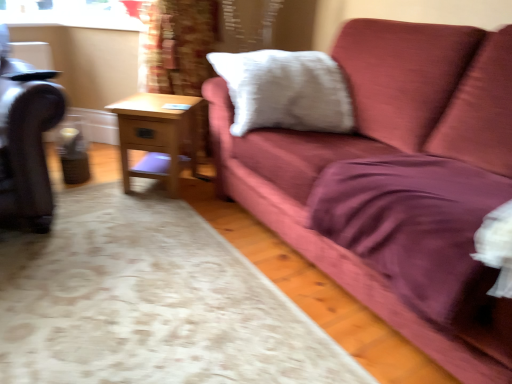
I want to click on wooden side table at center, so pos(159,135).

Describe the element at coordinates (285, 91) in the screenshot. I see `white soft pillow at upper center` at that location.

You are a GUI agent. You are given a task and a screenshot of the screen. Output one action in this format:
    pyautogui.click(x=<x>, y=<y>)
    Task: Click on the wooden side table at center
    The width and height of the screenshot is (512, 384).
    Given the screenshot: What is the action you would take?
    pyautogui.click(x=159, y=135)

Is white soft pillow at upper center wider than leather swivel chair at left?

No, white soft pillow at upper center is not wider than leather swivel chair at left.

From the image's perspective, is white soft pillow at upper center under leather swivel chair at left?

No.

Considering the relative sizes of white soft pillow at upper center and leather swivel chair at left in the image provided, is white soft pillow at upper center taller than leather swivel chair at left?

In fact, white soft pillow at upper center may be shorter than leather swivel chair at left.

Consider the image. Measure the distance from white soft pillow at upper center to leather swivel chair at left.

The distance of white soft pillow at upper center from leather swivel chair at left is 38.45 inches.

From a real-world perspective, is leather swivel chair at left physically below wooden side table at center?

No.

Considering the positions of objects leather swivel chair at left and wooden side table at center in the image provided, who is behind, leather swivel chair at left or wooden side table at center?

wooden side table at center is more distant.

Is leather swivel chair at left oriented towards wooden side table at center?

No, leather swivel chair at left is not oriented towards wooden side table at center.

Find the location of a particular element. Image resolution: width=512 pixels, height=384 pixels. swivel chair positioned vertically above the wooden side table at center (from a real-world perspective) is located at coordinates (26, 140).

Between white soft pillow at upper center and wooden side table at center, which one has less height?

wooden side table at center.

Would you say white soft pillow at upper center is to the left or to the right of wooden side table at center in the picture?

Based on their positions, white soft pillow at upper center is located to the right of wooden side table at center.

From a real-world perspective, who is located higher, white soft pillow at upper center or wooden side table at center?

white soft pillow at upper center is physically above.

Measure the distance from white soft pillow at upper center to wooden side table at center.

A distance of 50.00 centimeters exists between white soft pillow at upper center and wooden side table at center.

Is wooden side table at center facing away from leather swivel chair at left?

No.

Who is more distant, wooden side table at center or leather swivel chair at left?

wooden side table at center is more distant.

Measure the distance between wooden side table at center and leather swivel chair at left.

wooden side table at center is 54.48 centimeters away from leather swivel chair at left.

Do you think wooden side table at center is within leather swivel chair at left, or outside of it?

wooden side table at center is located beyond the bounds of leather swivel chair at left.

Between wooden side table at center and white soft pillow at upper center, which one has larger size?

Bigger between the two is white soft pillow at upper center.

Is point (183, 137) closer or farther from the camera than point (242, 57)?

Point (183, 137) is positioned farther from the camera compared to point (242, 57).

Is wooden side table at center in front of or behind white soft pillow at upper center in the image?

Visually, wooden side table at center is located behind white soft pillow at upper center.

Locate an element on the screen. The height and width of the screenshot is (384, 512). table to the left of white soft pillow at upper center is located at coordinates (159, 135).

Considering the positions of point (34, 219) and point (304, 130), is point (34, 219) closer or farther from the camera than point (304, 130)?

Clearly, point (34, 219) is closer to the camera than point (304, 130).

From a real-world perspective, does leather swivel chair at left sit lower than white soft pillow at upper center?

Yes, from a real-world perspective, leather swivel chair at left is under white soft pillow at upper center.

Does leather swivel chair at left have a smaller size compared to white soft pillow at upper center?

No, leather swivel chair at left is not smaller than white soft pillow at upper center.

Is leather swivel chair at left with white soft pillow at upper center?

No, leather swivel chair at left is not making contact with white soft pillow at upper center.

Where is `swivel chair in front of the white soft pillow at upper center`? swivel chair in front of the white soft pillow at upper center is located at coordinates (26, 140).

Find the location of `table on the right of leather swivel chair at left`. table on the right of leather swivel chair at left is located at coordinates (159, 135).

Which object lies further to the anchor point leather swivel chair at left, wooden side table at center or white soft pillow at upper center?

Based on the image, white soft pillow at upper center appears to be further to leather swivel chair at left.

Which object lies nearer to the anchor point wooden side table at center, white soft pillow at upper center or leather swivel chair at left?

white soft pillow at upper center lies closer to wooden side table at center than the other object.

Considering their positions, is white soft pillow at upper center positioned further to leather swivel chair at left than wooden side table at center?

Among the two, white soft pillow at upper center is located further to leather swivel chair at left.

Looking at the image, which one is located closer to white soft pillow at upper center, wooden side table at center or leather swivel chair at left?

wooden side table at center is positioned closer to the anchor white soft pillow at upper center.

Which object lies further to the anchor point wooden side table at center, leather swivel chair at left or white soft pillow at upper center?

leather swivel chair at left is positioned further to the anchor wooden side table at center.

Looking at the image, which one is located further to white soft pillow at upper center, leather swivel chair at left or wooden side table at center?

Among the two, leather swivel chair at left is located further to white soft pillow at upper center.

Locate an element on the screen. Image resolution: width=512 pixels, height=384 pixels. table located between leather swivel chair at left and white soft pillow at upper center in the left-right direction is located at coordinates (159, 135).